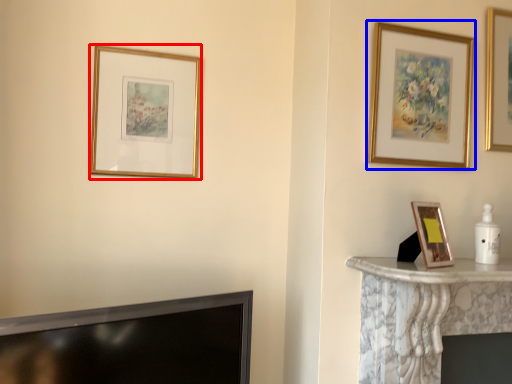
Question: Which object appears closest to the camera in this image, picture frame (highlighted by a red box) or picture frame (highlighted by a blue box)?

Choices:
 (A) picture frame
 (B) picture frame

Answer: (B)